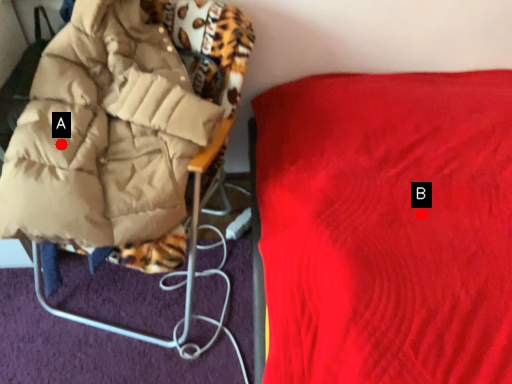
Question: Two points are circled on the image, labeled by A and B beside each circle. Among these points, which one is nearest to the camera?

Choices:
 (A) A is closer
 (B) B is closer

Answer: (B)